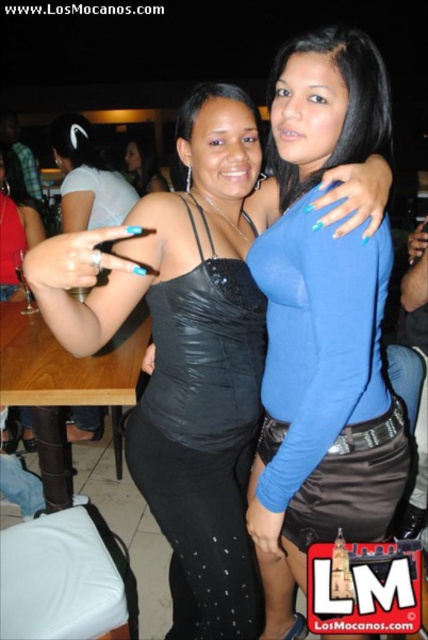
Can you confirm if blue satin top at center is taller than black satin dress at center?

Correct, blue satin top at center is much taller as black satin dress at center.

Is blue satin top at center behind black satin dress at center?

No, blue satin top at center is closer to the viewer.

Is point (276, 557) farther from viewer compared to point (252, 324)?

That is True.

You are a GUI agent. You are given a task and a screenshot of the screen. Output one action in this format:
    pyautogui.click(x=<x>, y=<y>)
    Task: Click on the blue satin top at center
    The width and height of the screenshot is (428, 640).
    Given the screenshot: What is the action you would take?
    pyautogui.click(x=323, y=324)

Is the position of black satin dress at center more distant than that of matte black dress at center?

No.

Which of these two, black satin dress at center or matte black dress at center, stands taller?

black satin dress at center

Does point (238, 588) come in front of point (148, 173)?

Yes, point (238, 588) is closer to viewer.

Identify the location of black satin dress at center. (204, 438).

Is blue satin top at center shorter than matte black dress at center?

In fact, blue satin top at center may be taller than matte black dress at center.

Which is more to the left, blue satin top at center or matte black dress at center?

Positioned to the left is matte black dress at center.

Where is `blue satin top at center`? This screenshot has width=428, height=640. blue satin top at center is located at coordinates (323, 324).